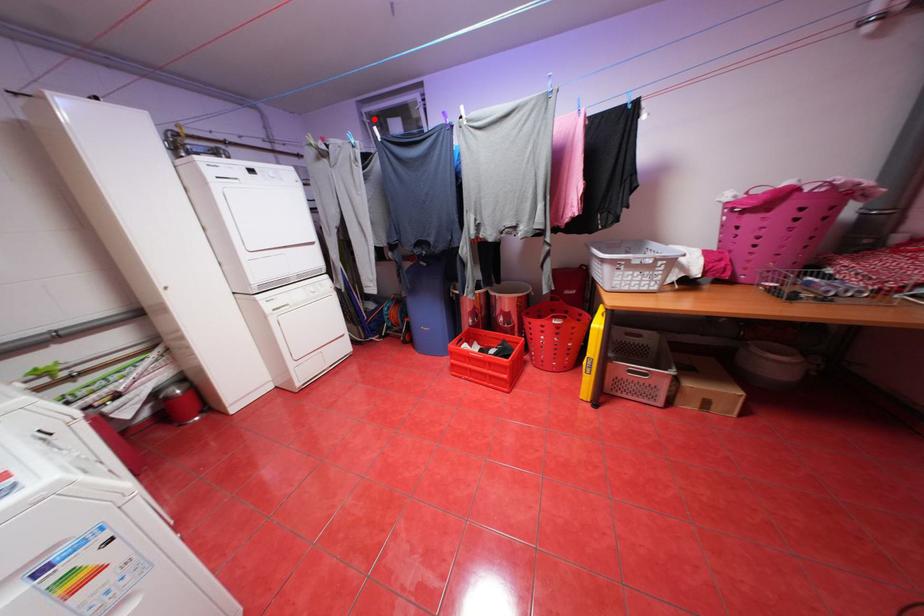
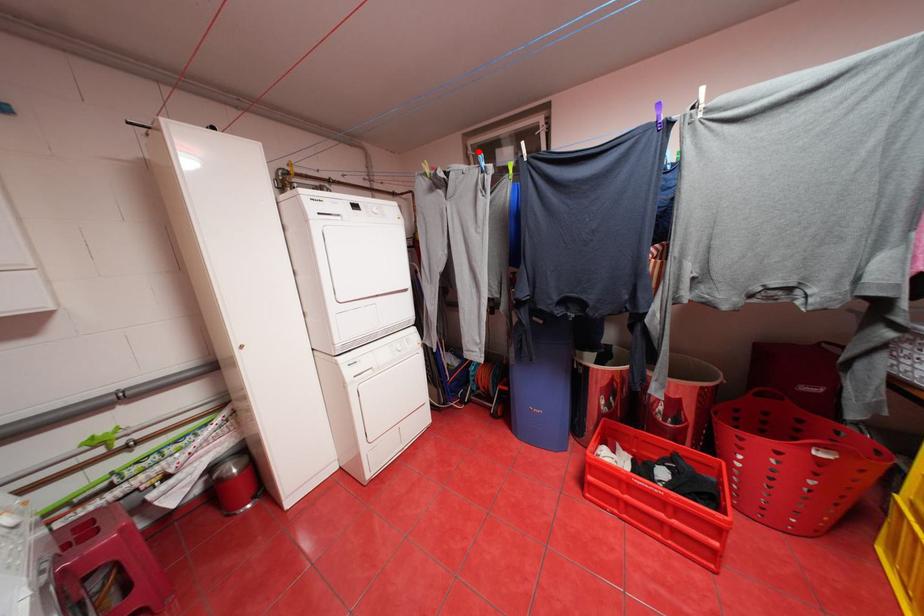
I am providing you with two images of the same scene from different viewpoints. A red point is marked on the first image and another point is marked on the second image. Is the marked point in image1 the same physical position as the marked point in image2?

Yes